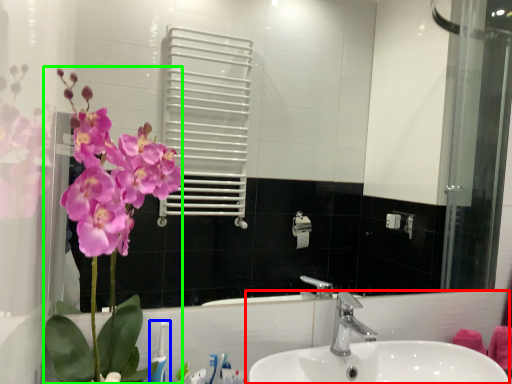
Question: Which is nearer to the sink (highlighted by a red box)? toothbrush (highlighted by a blue box) or floral arrangement (highlighted by a green box).

Choices:
 (A) toothbrush
 (B) floral arrangement

Answer: (A)